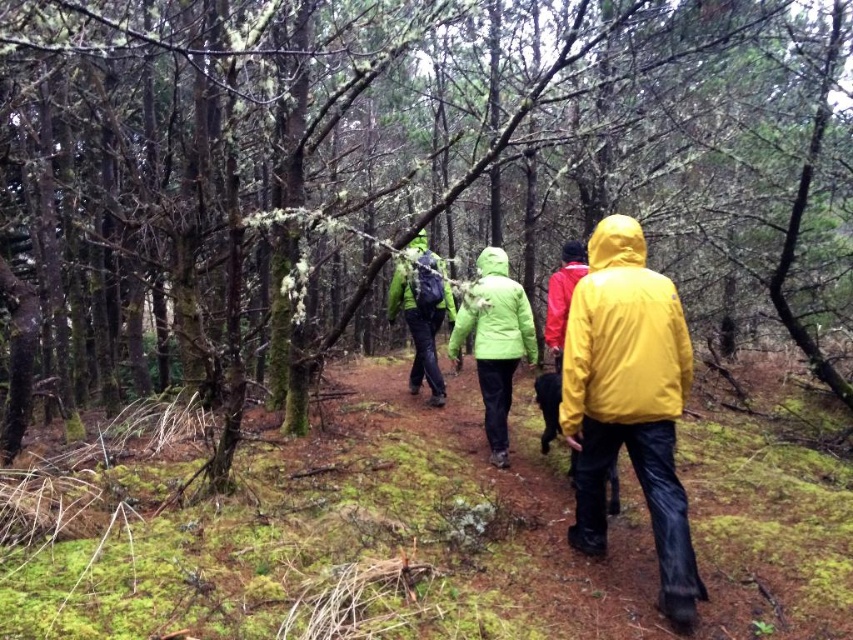
The width and height of the screenshot is (853, 640). What do you see at coordinates (494, 314) in the screenshot?
I see `green matte jacket at center` at bounding box center [494, 314].

Does green matte jacket at center have a smaller size compared to red matte jacket at center?

No, green matte jacket at center is not smaller than red matte jacket at center.

Who is more forward, (483, 346) or (564, 282)?

Point (564, 282) is in front.

You are a GUI agent. You are given a task and a screenshot of the screen. Output one action in this format:
    pyautogui.click(x=<x>, y=<y>)
    Task: Click on the green matte jacket at center
    This screenshot has height=640, width=853.
    Given the screenshot: What is the action you would take?
    pyautogui.click(x=494, y=314)

Is green matte jacket at center below matte green jacket at center?

Indeed, green matte jacket at center is positioned under matte green jacket at center.

This screenshot has height=640, width=853. I want to click on green matte jacket at center, so click(x=494, y=314).

Is point (473, 284) positioned in front of point (396, 289)?

Yes, it is.

Locate an element on the screen. This screenshot has width=853, height=640. green matte jacket at center is located at coordinates (494, 314).

Who is positioned more to the right, yellow waterproof jacket at center or yellow matte jacket at center?

yellow matte jacket at center

Can you confirm if yellow waterproof jacket at center is thinner than yellow matte jacket at center?

In fact, yellow waterproof jacket at center might be wider than yellow matte jacket at center.

Which is in front, point (606, 244) or point (662, 282)?

Point (662, 282) is in front.

At what (x,y) coordinates should I click in order to perform the action: click on yellow waterproof jacket at center. Please return your answer as a coordinate pair (x, y). Looking at the image, I should click on (630, 403).